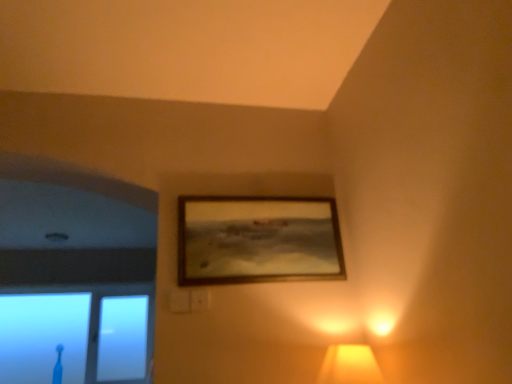
What do you see at coordinates (76, 333) in the screenshot? I see `transparent glass toothbrush at lower left` at bounding box center [76, 333].

This screenshot has width=512, height=384. Describe the element at coordinates (350, 365) in the screenshot. I see `matte yellow lampshade at lower right` at that location.

Find the location of a particular element. The image size is (512, 384). wooden frame at upper center is located at coordinates [x=257, y=240].

Which object is closer to the camera taking this photo, wooden frame at upper center or transparent glass toothbrush at lower left?

Positioned in front is wooden frame at upper center.

Is point (215, 208) closer or farther from the camera than point (106, 285)?

Point (215, 208) is closer to the camera than point (106, 285).

Based on the photo, does wooden frame at upper center turn towards transparent glass toothbrush at lower left?

No, wooden frame at upper center is not facing towards transparent glass toothbrush at lower left.

Is transparent glass toothbrush at lower left aimed at wooden frame at upper center?

Yes, transparent glass toothbrush at lower left faces towards wooden frame at upper center.

Considering the relative sizes of transparent glass toothbrush at lower left and wooden frame at upper center in the image provided, is transparent glass toothbrush at lower left shorter than wooden frame at upper center?

No.

Who is more distant, transparent glass toothbrush at lower left or wooden frame at upper center?

transparent glass toothbrush at lower left is further away from the camera.

Between point (195, 200) and point (339, 375), which one is positioned in front?

The point (339, 375) is more forward.

Locate an element on the screen. The height and width of the screenshot is (384, 512). lamp below the wooden frame at upper center (from the image's perspective) is located at coordinates (350, 365).

Can you confirm if wooden frame at upper center is shorter than matte yellow lampshade at lower right?

Incorrect, the height of wooden frame at upper center does not fall short of that of matte yellow lampshade at lower right.

Are wooden frame at upper center and matte yellow lampshade at lower right making contact?

wooden frame at upper center and matte yellow lampshade at lower right are not in contact.

Does matte yellow lampshade at lower right come in front of wooden frame at upper center?

Yes, it is.

Which is farther, (362, 371) or (236, 217)?

The point (236, 217) is farther.

Consider the image. Would you say matte yellow lampshade at lower right contains wooden frame at upper center?

Definitely not — wooden frame at upper center is not inside matte yellow lampshade at lower right.

Does matte yellow lampshade at lower right appear on the left side of wooden frame at upper center?

No, matte yellow lampshade at lower right is not to the left of wooden frame at upper center.

Which is in front, point (350, 351) or point (104, 350)?

The point (350, 351) is closer.

What are the coordinates of `lamp that appears above the transparent glass toothbrush at lower left (from the image's perspective)` in the screenshot? It's located at (350, 365).

Looking at this image, is matte yellow lampshade at lower right beside transparent glass toothbrush at lower left?

They are not placed beside each other.

Who is taller, matte yellow lampshade at lower right or transparent glass toothbrush at lower left?

transparent glass toothbrush at lower left is taller.

From the image's perspective, is transparent glass toothbrush at lower left on top of matte yellow lampshade at lower right?

No, from the image's perspective, transparent glass toothbrush at lower left is not on top of matte yellow lampshade at lower right.

Is transparent glass toothbrush at lower left thinner than matte yellow lampshade at lower right?

Yes.

Which is correct: transparent glass toothbrush at lower left is inside matte yellow lampshade at lower right, or outside of it?

transparent glass toothbrush at lower left is outside matte yellow lampshade at lower right.

The image size is (512, 384). I want to click on picture frame to the right of transparent glass toothbrush at lower left, so click(257, 240).

Find the location of `window that appears behind the wooden frame at upper center`. window that appears behind the wooden frame at upper center is located at coordinates (76, 333).

Which object lies further to the anchor point wooden frame at upper center, transparent glass toothbrush at lower left or matte yellow lampshade at lower right?

Based on the image, transparent glass toothbrush at lower left appears to be further to wooden frame at upper center.

Based on their spatial positions, is transparent glass toothbrush at lower left or wooden frame at upper center closer to matte yellow lampshade at lower right?

wooden frame at upper center.

Which object lies further to the anchor point transparent glass toothbrush at lower left, matte yellow lampshade at lower right or wooden frame at upper center?

Among the two, matte yellow lampshade at lower right is located further to transparent glass toothbrush at lower left.

In the scene shown: Considering their positions, is matte yellow lampshade at lower right positioned further to wooden frame at upper center than transparent glass toothbrush at lower left?

transparent glass toothbrush at lower left is further to wooden frame at upper center.

Which object lies nearer to the anchor point matte yellow lampshade at lower right, wooden frame at upper center or transparent glass toothbrush at lower left?

wooden frame at upper center is closer to matte yellow lampshade at lower right.

Looking at the image, which one is located closer to transparent glass toothbrush at lower left, wooden frame at upper center or matte yellow lampshade at lower right?

wooden frame at upper center.

Where is `picture frame between transparent glass toothbrush at lower left and matte yellow lampshade at lower right in the horizontal direction`? picture frame between transparent glass toothbrush at lower left and matte yellow lampshade at lower right in the horizontal direction is located at coordinates (257, 240).